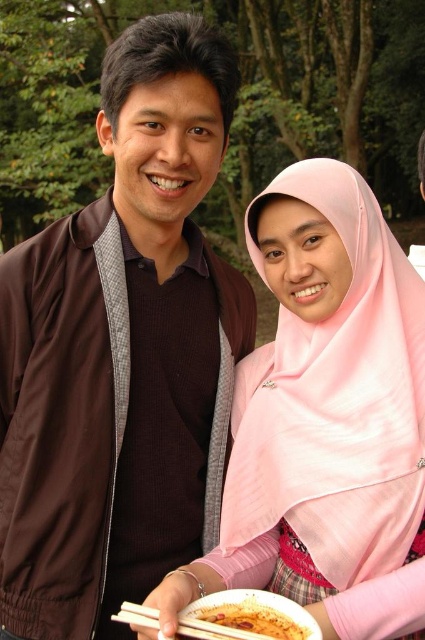
Measure the distance between white matte chopsticks at lower center and yellowish matte food at lower center.

They are 1.58 inches apart.

Is white matte chopsticks at lower center in front of yellowish matte food at lower center?

Yes.

Is point (189, 636) more distant than point (303, 630)?

No, (189, 636) is closer to viewer.

Locate an element on the screen. This screenshot has width=425, height=640. white matte chopsticks at lower center is located at coordinates (223, 625).

At what (x,y) coordinates should I click in order to perform the action: click on brown matte jacket at left. Please return your answer as a coordinate pair (x, y). Looking at the image, I should click on (121, 352).

Is brown matte jacket at left to the left of white matte chopsticks at lower center from the viewer's perspective?

Yes, brown matte jacket at left is to the left of white matte chopsticks at lower center.

Image resolution: width=425 pixels, height=640 pixels. I want to click on brown matte jacket at left, so click(x=121, y=352).

Where is `brown matte jacket at left`? brown matte jacket at left is located at coordinates (121, 352).

Which is above, brown matte jacket at left or yellowish matte food at lower center?

brown matte jacket at left is higher up.

Measure the distance between brown matte jacket at left and yellowish matte food at lower center.

brown matte jacket at left is 84.40 centimeters from yellowish matte food at lower center.

Between point (110, 280) and point (251, 628), which one is positioned behind?

Positioned behind is point (110, 280).

Where is `brown matte jacket at left`? The image size is (425, 640). brown matte jacket at left is located at coordinates [x=121, y=352].